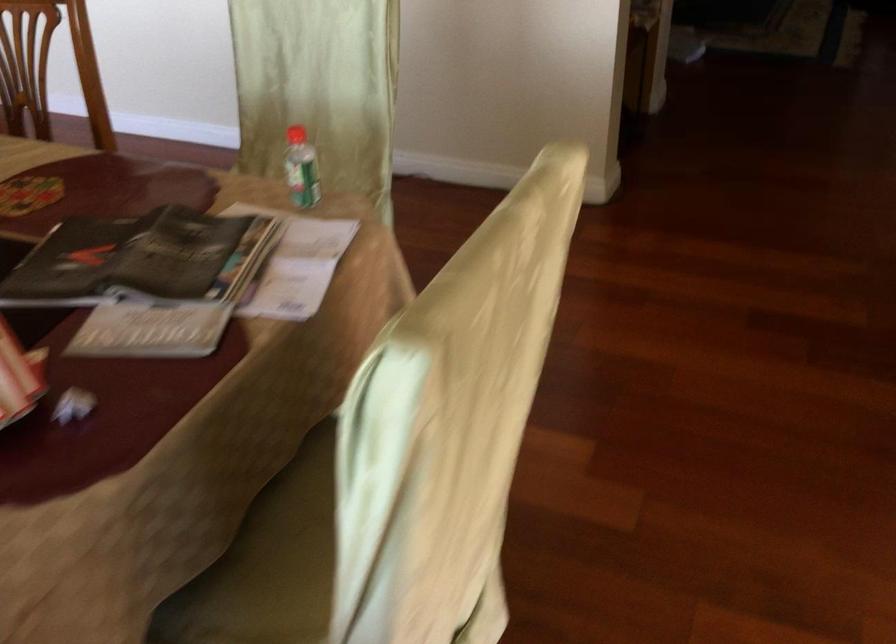
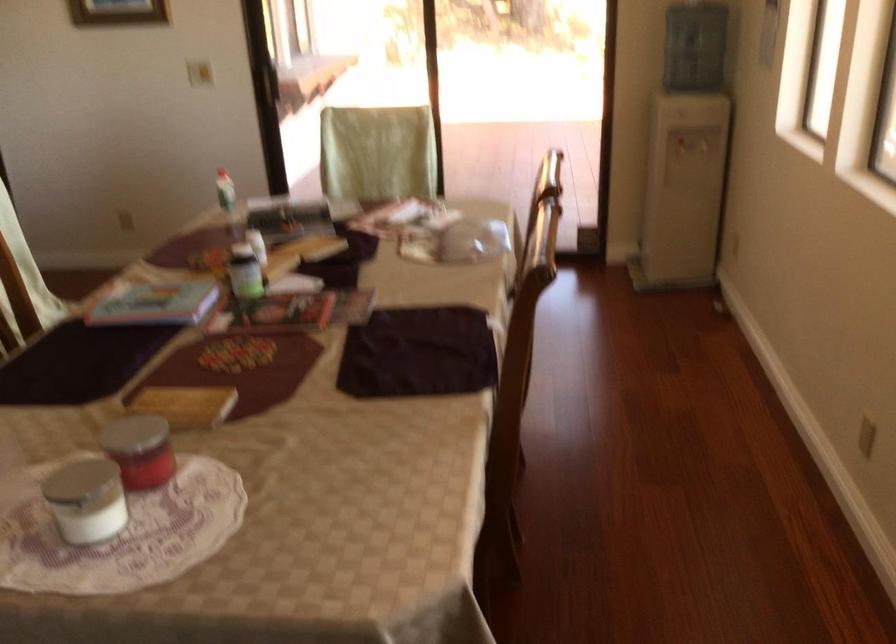
Question: I am providing you with two images of the same scene from different viewpoints. After the viewpoint changes to image2, which objects are now occluded?

Choices:
 (A) stuffed toy duck
 (B) red bottle cap
 (C) blue water bottle
 (D) chair sitting surface

Answer: (B)